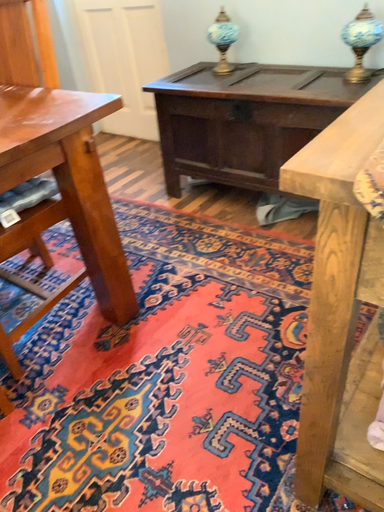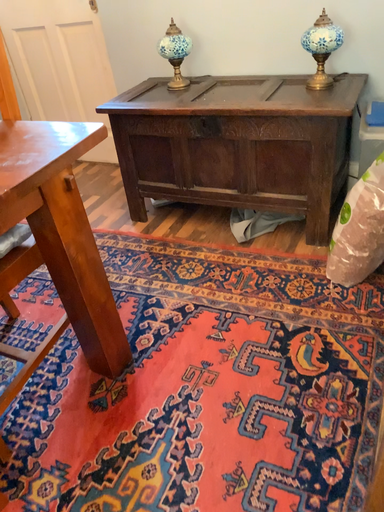
Question: How did the camera likely rotate when shooting the video?

Choices:
 (A) rotated right
 (B) rotated left

Answer: (A)